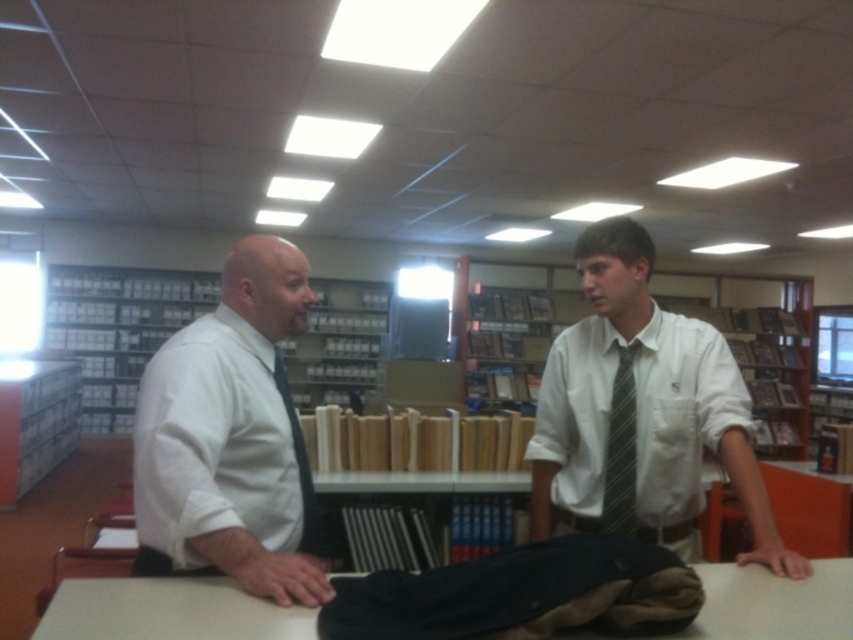
Question: Which point appears farthest from the camera in this image?

Choices:
 (A) (103, 364)
 (B) (10, 378)

Answer: (A)

Question: Which object is farther from the camera taking this photo?

Choices:
 (A) matte black tie at left
 (B) green striped tie at center
 (C) white shirt at left

Answer: (B)

Question: Can you confirm if white shirt at left is positioned to the right of white cardboard bookshelf at left?

Choices:
 (A) no
 (B) yes

Answer: (B)

Question: Where is white shirt at left located in relation to white cardboard bookshelf at left in the image?

Choices:
 (A) left
 (B) right

Answer: (B)

Question: Does white shirt with tie at center have a smaller size compared to white cardboard bookshelf at left?

Choices:
 (A) no
 (B) yes

Answer: (B)

Question: Among these objects, which one is farthest from the camera?

Choices:
 (A) green striped tie at center
 (B) white shirt with tie at center
 (C) white smooth table at center
 (D) white cardboard bookshelf at upper center

Answer: (D)